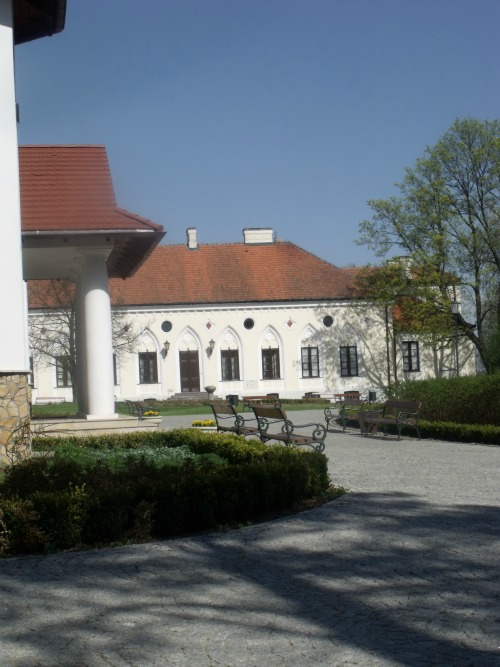
Locate an element on the screen. The width and height of the screenshot is (500, 667). bench is located at coordinates (286, 438), (246, 429), (385, 421), (343, 415).